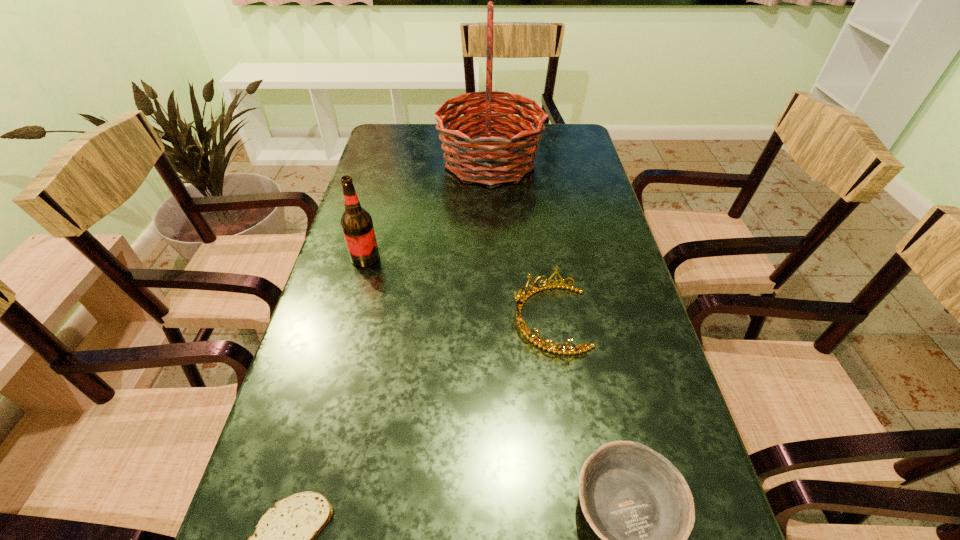
Locate an element on the screen. This screenshot has width=960, height=540. vacant space at the right edge is located at coordinates (609, 231).

The height and width of the screenshot is (540, 960). Identify the location of vacant space at the far left corner. (404, 152).

The width and height of the screenshot is (960, 540). What are the coordinates of `vacant space at the far right corner of the desktop` in the screenshot? It's located at (555, 134).

The height and width of the screenshot is (540, 960). I want to click on free area in between the fourth nearest object and the third shortest object, so click(x=458, y=288).

Locate an element on the screen. The height and width of the screenshot is (540, 960). vacant area that lies between the fourth nearest object and the third farthest object is located at coordinates (458, 288).

Find the location of `vacant point located between the basket and the third nearest object`. vacant point located between the basket and the third nearest object is located at coordinates (520, 240).

Where is `vacant space that's between the root beer and the tallest object`? vacant space that's between the root beer and the tallest object is located at coordinates (427, 210).

Where is `object that is the second closest to the basket`? The width and height of the screenshot is (960, 540). object that is the second closest to the basket is located at coordinates (519, 304).

Select which object is the closest to the shortest object. Please provide its 2D coordinates. Your answer should be formatted as a tuple, i.e. [(x, y)], where the tuple contains the x and y coordinates of a point satisfying the conditions above.

[(635, 500)]